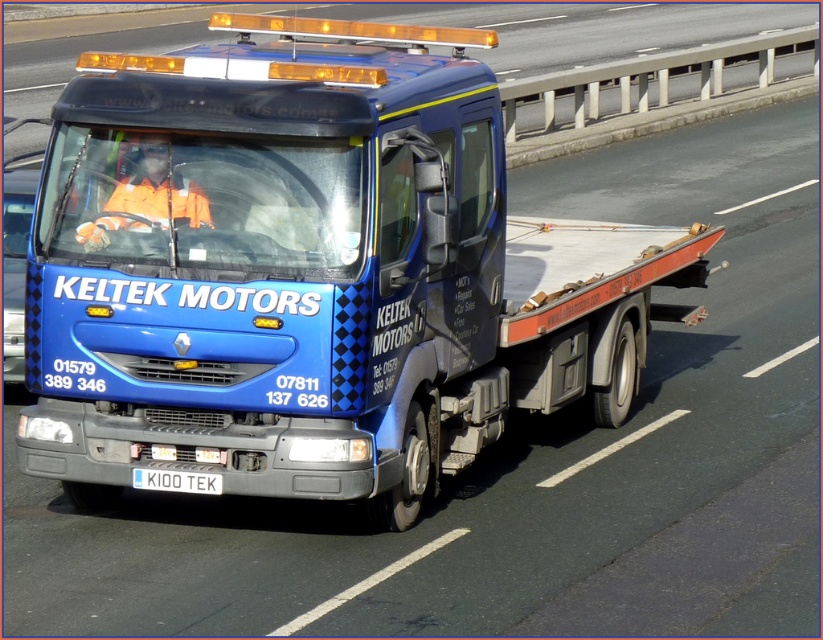
Question: Observing the image, what is the correct spatial positioning of blue metallic tow truck at center in reference to white plastic license plate at center?

Choices:
 (A) right
 (B) left

Answer: (A)

Question: Which object is farther from the camera taking this photo?

Choices:
 (A) white plastic license plate at center
 (B) blue metallic tow truck at center

Answer: (B)

Question: Can you confirm if blue metallic tow truck at center is thinner than white plastic license plate at center?

Choices:
 (A) no
 (B) yes

Answer: (A)

Question: Does blue metallic tow truck at center appear under white plastic license plate at center?

Choices:
 (A) no
 (B) yes

Answer: (A)